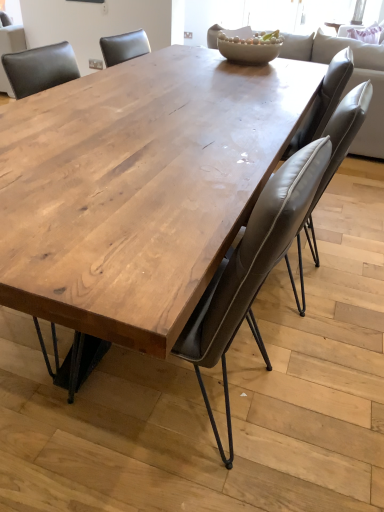
The width and height of the screenshot is (384, 512). I want to click on free space to the left of matte ceramic bowl at center, so click(x=182, y=52).